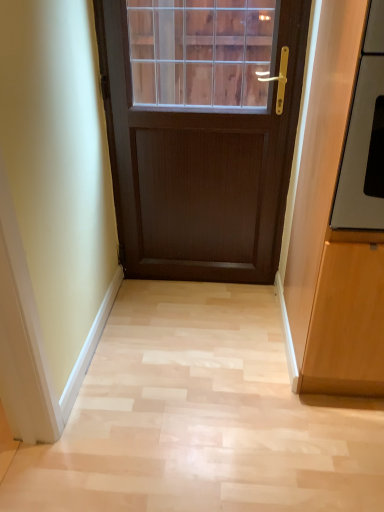
Question: Is matte wood cabinet at right at the right side of light wood floor at center?

Choices:
 (A) yes
 (B) no

Answer: (A)

Question: Is matte wood cabinet at right surrounding light wood floor at center?

Choices:
 (A) yes
 (B) no

Answer: (B)

Question: Would you consider matte wood cabinet at right to be distant from light wood floor at center?

Choices:
 (A) yes
 (B) no

Answer: (B)

Question: Can you confirm if matte wood cabinet at right is wider than light wood floor at center?

Choices:
 (A) no
 (B) yes

Answer: (A)

Question: Is matte wood cabinet at right turned away from light wood floor at center?

Choices:
 (A) yes
 (B) no

Answer: (B)

Question: Is satin silver oven at right wider or thinner than light wood floor at center?

Choices:
 (A) wide
 (B) thin

Answer: (B)

Question: In terms of size, does satin silver oven at right appear bigger or smaller than light wood floor at center?

Choices:
 (A) small
 (B) big

Answer: (B)

Question: Considering their positions, is satin silver oven at right located in front of or behind light wood floor at center?

Choices:
 (A) front
 (B) behind

Answer: (A)

Question: Visually, is satin silver oven at right positioned to the left or to the right of light wood floor at center?

Choices:
 (A) left
 (B) right

Answer: (B)

Question: Is matte wood cabinet at right bigger or smaller than light wood floor at center?

Choices:
 (A) big
 (B) small

Answer: (A)

Question: Is matte wood cabinet at right in front of or behind light wood floor at center in the image?

Choices:
 (A) front
 (B) behind

Answer: (A)

Question: Considering the relative positions of matte wood cabinet at right and light wood floor at center in the image provided, is matte wood cabinet at right to the left or to the right of light wood floor at center?

Choices:
 (A) left
 (B) right

Answer: (B)

Question: Which is correct: matte wood cabinet at right is inside light wood floor at center, or outside of it?

Choices:
 (A) outside
 (B) inside

Answer: (A)

Question: Is point (334, 89) positioned closer to the camera than point (364, 134)?

Choices:
 (A) closer
 (B) farther

Answer: (B)

Question: In the image, is matte wood cabinet at right on the left side or the right side of satin silver oven at right?

Choices:
 (A) left
 (B) right

Answer: (B)